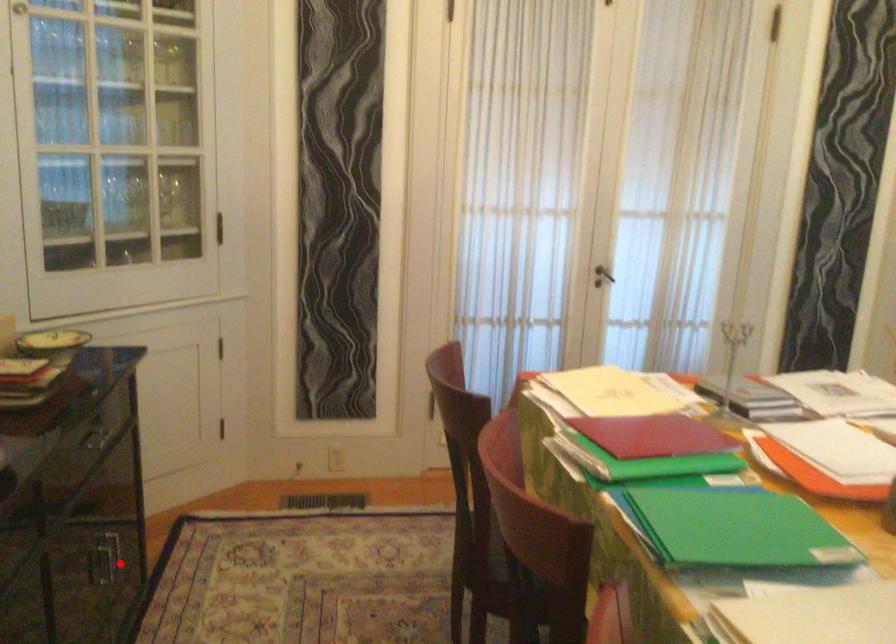
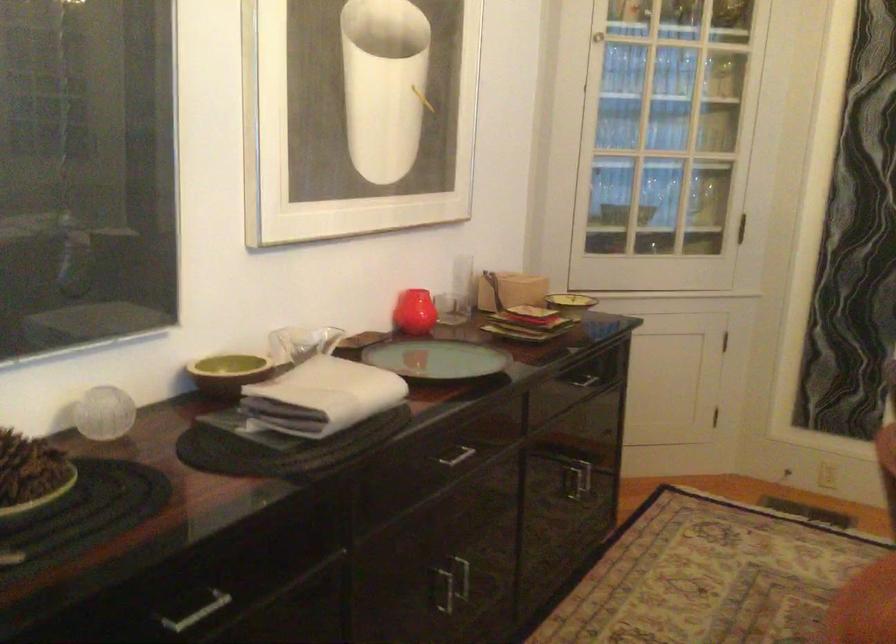
Question: I am providing you with two images of the same scene from different viewpoints. Image1 has a red point marked. In image2, the corresponding 3D location appears at what relative position? Reply with the corresponding letter.

Choices:
 (A) Closer
 (B) Farther

Answer: (B)